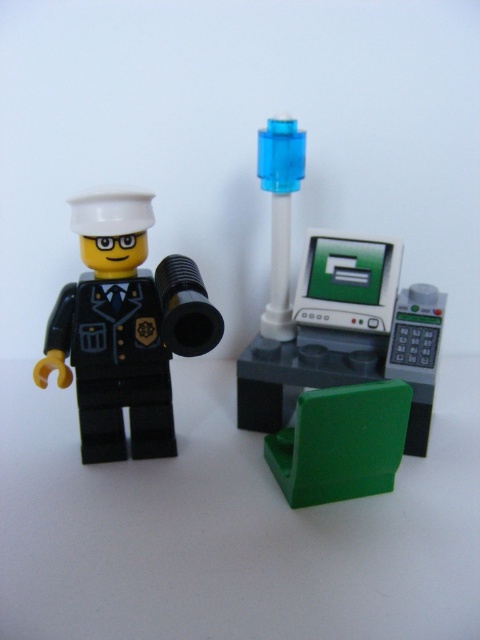
Question: Can you confirm if green plastic chair at lower center is positioned to the right of transparent blue cylinder at center?

Choices:
 (A) yes
 (B) no

Answer: (A)

Question: Estimate the real-world distances between objects in this image. Which object is farther from the transparent blue cylinder at center?

Choices:
 (A) green plastic chair at lower center
 (B) green plastic chair at lower right

Answer: (A)

Question: Is green plastic chair at lower center to the right of transparent blue cylinder at center from the viewer's perspective?

Choices:
 (A) yes
 (B) no

Answer: (A)

Question: Which point is farther from the camera taking this photo?

Choices:
 (A) (144, 403)
 (B) (280, 145)

Answer: (B)

Question: Among these points, which one is nearest to the camera?

Choices:
 (A) [403, 326]
 (B) [133, 348]

Answer: (B)

Question: Does black matte minifigure at left appear on the right side of green plastic chair at lower right?

Choices:
 (A) yes
 (B) no

Answer: (B)